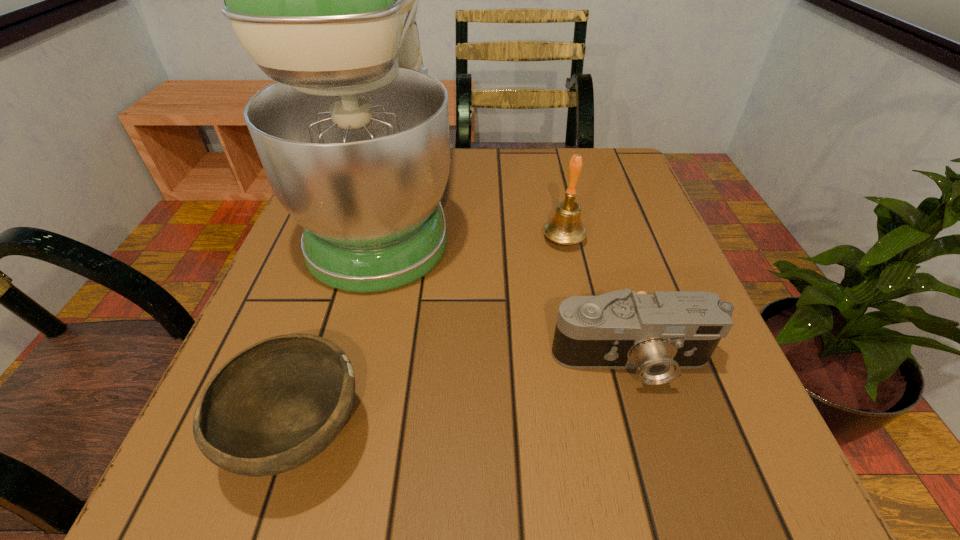
Where is `unoccupied area between the tallest object and the camera`? The width and height of the screenshot is (960, 540). unoccupied area between the tallest object and the camera is located at coordinates (509, 287).

This screenshot has height=540, width=960. What are the coordinates of `vacant area between the camera and the tallest object` in the screenshot? It's located at (509, 287).

Find the location of a particular element. The width and height of the screenshot is (960, 540). free spot between the tallest object and the camera is located at coordinates (509, 287).

What are the coordinates of `vacant region between the bowl and the mixer` in the screenshot? It's located at (343, 323).

The width and height of the screenshot is (960, 540). Find the location of `blank region between the mixer and the bell`. blank region between the mixer and the bell is located at coordinates (475, 226).

Locate an element on the screen. The height and width of the screenshot is (540, 960). free space between the camera and the bowl is located at coordinates (466, 397).

Locate an element on the screen. vacant space that is in between the tallest object and the camera is located at coordinates (509, 287).

Locate an element on the screen. The image size is (960, 540). blank region between the mixer and the camera is located at coordinates (509, 287).

This screenshot has width=960, height=540. I want to click on the second closest object relative to the tallest object, so click(565, 227).

Identify which object is the second closest to the bell. Please provide its 2D coordinates. Your answer should be formatted as a tuple, i.e. [(x, y)], where the tuple contains the x and y coordinates of a point satisfying the conditions above.

[(659, 334)]